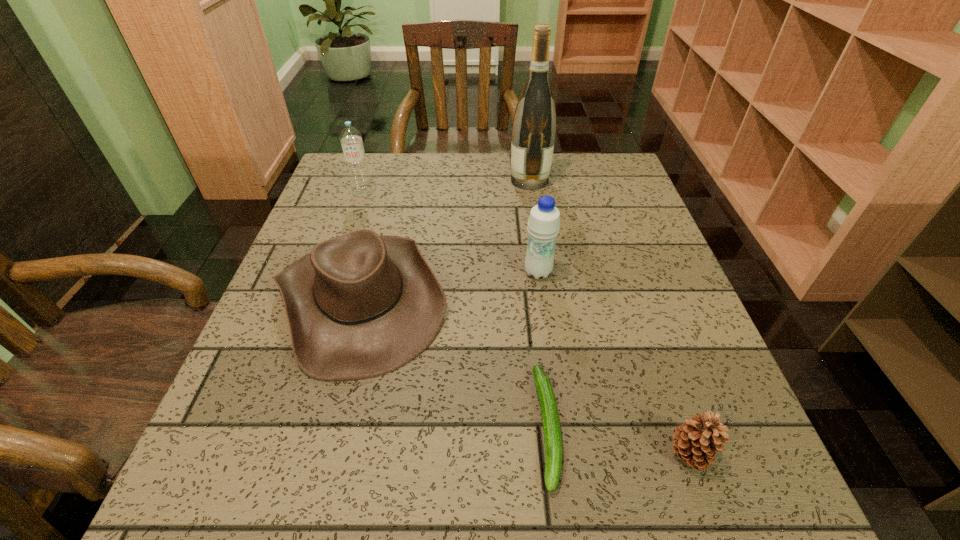
Where is `object present at the right edge`? object present at the right edge is located at coordinates (696, 442).

The height and width of the screenshot is (540, 960). I want to click on object present at the far left corner, so click(351, 138).

This screenshot has height=540, width=960. What are the coordinates of `object that is at the near right corner` in the screenshot? It's located at (696, 442).

Identify the location of free space at the far edge. The width and height of the screenshot is (960, 540). (468, 200).

Image resolution: width=960 pixels, height=540 pixels. Identify the location of free location at the near edge of the desktop. (444, 526).

Find the location of a particular element. vacant point at the left edge is located at coordinates (281, 318).

In order to click on free space at the right edge in this screenshot , I will do `click(584, 218)`.

Find the location of a particular element. free space at the far left corner of the desktop is located at coordinates (348, 194).

Locate an element on the screen. free space at the near left corner of the desktop is located at coordinates (267, 472).

In the image, there is a desktop. Where is `vacant space at the far right corner`? Image resolution: width=960 pixels, height=540 pixels. vacant space at the far right corner is located at coordinates (619, 184).